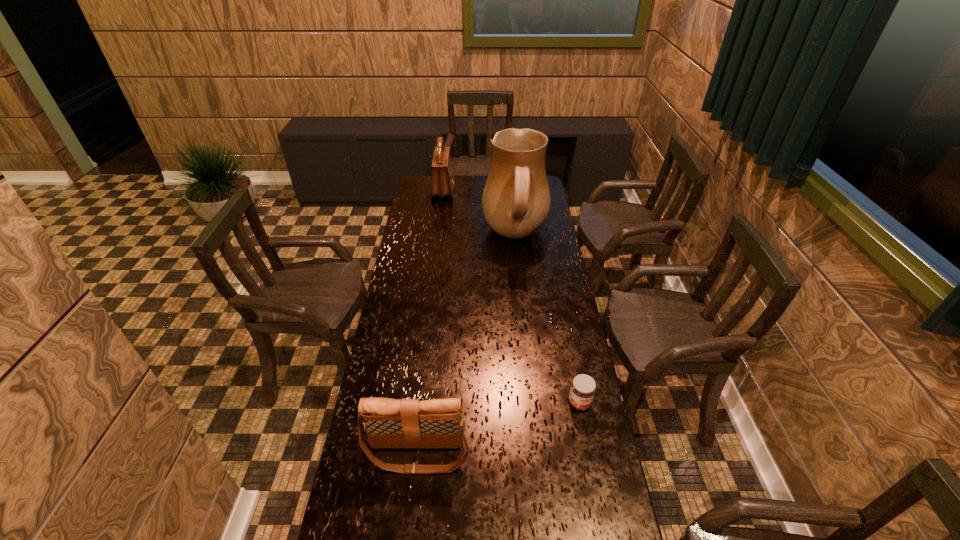
Identify which object is the third nearest to the third tallest object. Please provide its 2D coordinates. Your answer should be formatted as a tuple, i.e. [(x, y)], where the tuple contains the x and y coordinates of a point satisfying the conditions above.

[(442, 178)]

Locate an element on the screen. Image resolution: width=960 pixels, height=540 pixels. the second closest object to the second nearest object is located at coordinates (516, 200).

What are the coordinates of `free region that satisfies the following two spatial constraints: 1. at the spout of the third nearest object; 2. on the right side of the shortest object` in the screenshot? It's located at (532, 403).

Locate an element on the screen. vacant space that satisfies the following two spatial constraints: 1. at the spout of the third nearest object; 2. on the front-facing side of the nearest object is located at coordinates (538, 453).

Locate an element on the screen. vacant point that satisfies the following two spatial constraints: 1. at the spout of the tallest object; 2. on the front-facing side of the second shortest object is located at coordinates (538, 453).

Where is `vacant point that satisfies the following two spatial constraints: 1. at the spout of the second farthest object; 2. on the front-facing side of the shorter shoulder bag`? This screenshot has height=540, width=960. vacant point that satisfies the following two spatial constraints: 1. at the spout of the second farthest object; 2. on the front-facing side of the shorter shoulder bag is located at coordinates (538, 453).

The width and height of the screenshot is (960, 540). What are the coordinates of `free spot that satisfies the following two spatial constraints: 1. at the spout of the shortest object; 2. on the left side of the cream pitcher` in the screenshot? It's located at (532, 403).